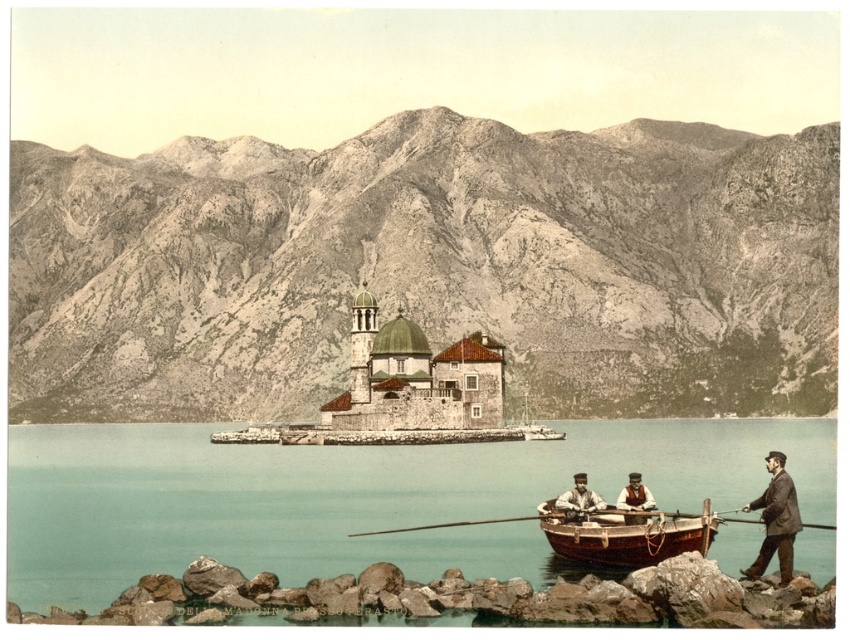
Question: Which point is farther to the camera?

Choices:
 (A) (650, 461)
 (B) (542, 307)
 (C) (775, 550)
 (D) (621, 499)

Answer: (B)

Question: Which point is closer to the camera taking this photo?

Choices:
 (A) (264, 406)
 (B) (769, 556)
 (C) (576, 513)

Answer: (B)

Question: Which object appears closest to the camera in this image?

Choices:
 (A) brown leather jacket at lower right
 (B) brown leather jacket at center
 (C) light brown wooden oars at lower center
 (D) wooden canoe at lower center

Answer: (A)

Question: In this image, where is brown leather jacket at lower right located relative to light brown wooden oars at lower center?

Choices:
 (A) right
 (B) left

Answer: (A)

Question: Does rugged stone mountain at upper center have a greater width compared to wooden canoe at lower center?

Choices:
 (A) no
 (B) yes

Answer: (B)

Question: Does rugged stone mountain at upper center appear on the right side of wooden canoe at lower center?

Choices:
 (A) yes
 (B) no

Answer: (B)